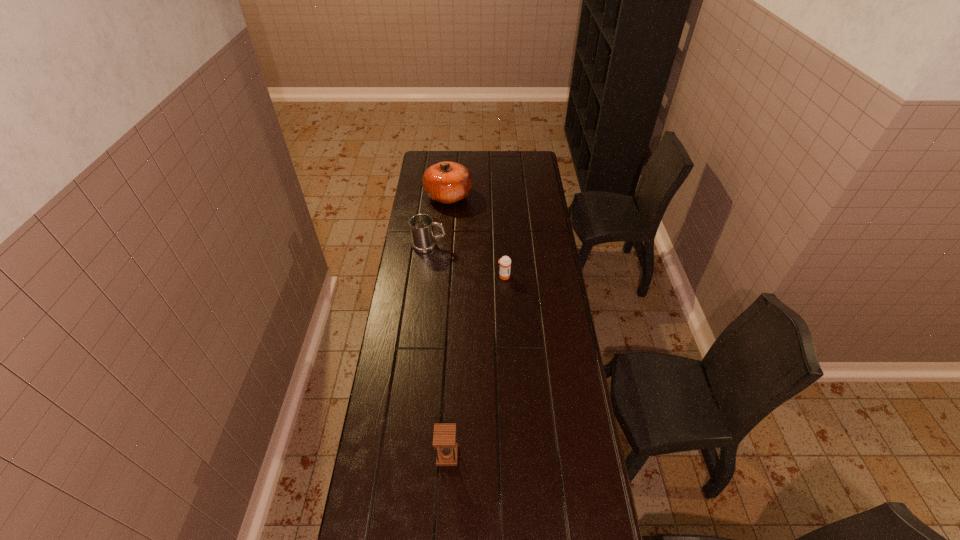
The image size is (960, 540). In order to click on pumpkin in this screenshot , I will do `click(447, 182)`.

You are a GUI agent. You are given a task and a screenshot of the screen. Output one action in this format:
    pyautogui.click(x=<x>, y=<y>)
    Task: Click on the farthest object
    The height and width of the screenshot is (540, 960).
    Given the screenshot: What is the action you would take?
    click(x=447, y=182)

Identify the location of the third nearest object. (423, 239).

Identify the location of hourglass. (444, 436).

Locate an element on the screen. This screenshot has width=960, height=540. the rightmost object is located at coordinates (505, 262).

At what (x,y) coordinates should I click in order to perform the action: click on medicine. Please return your answer as a coordinate pair (x, y). The height and width of the screenshot is (540, 960). Looking at the image, I should click on (505, 262).

Where is `free spot located on the front of the pumpkin`? free spot located on the front of the pumpkin is located at coordinates (445, 229).

Find the location of a particular element. The height and width of the screenshot is (540, 960). free space located on the side of the second farthest object with the handle is located at coordinates (497, 246).

This screenshot has height=540, width=960. I want to click on free space located 0.370m on the back of the hourglass, so click(x=452, y=352).

Identify the location of free space located 0.300m on the front of the medicine. This screenshot has height=540, width=960. (507, 334).